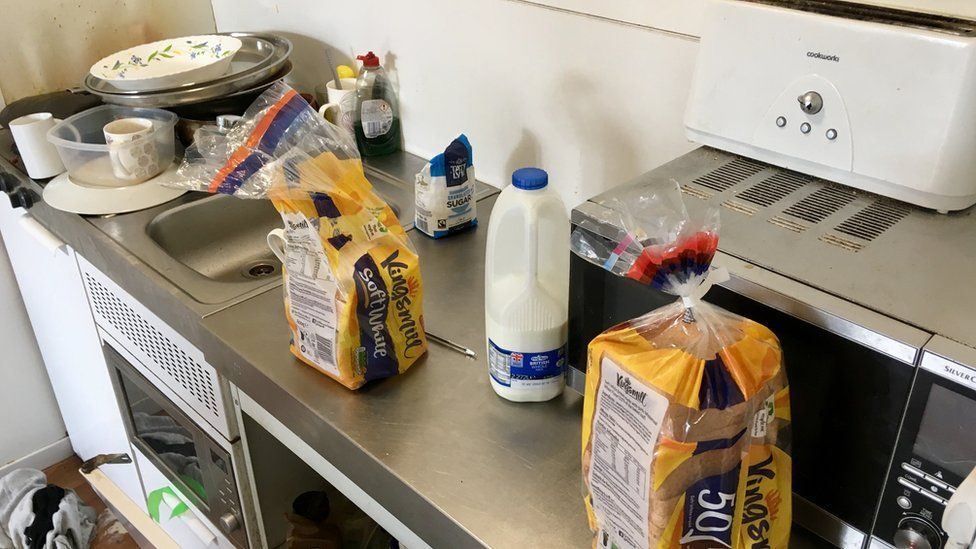
The width and height of the screenshot is (976, 549). Find the location of `microwave screen`. microwave screen is located at coordinates (944, 432), (952, 408).